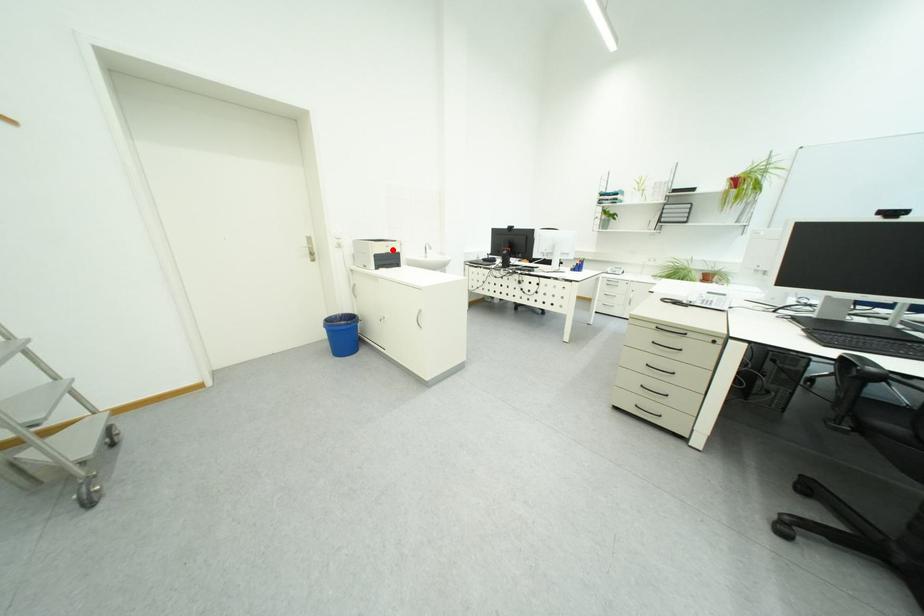
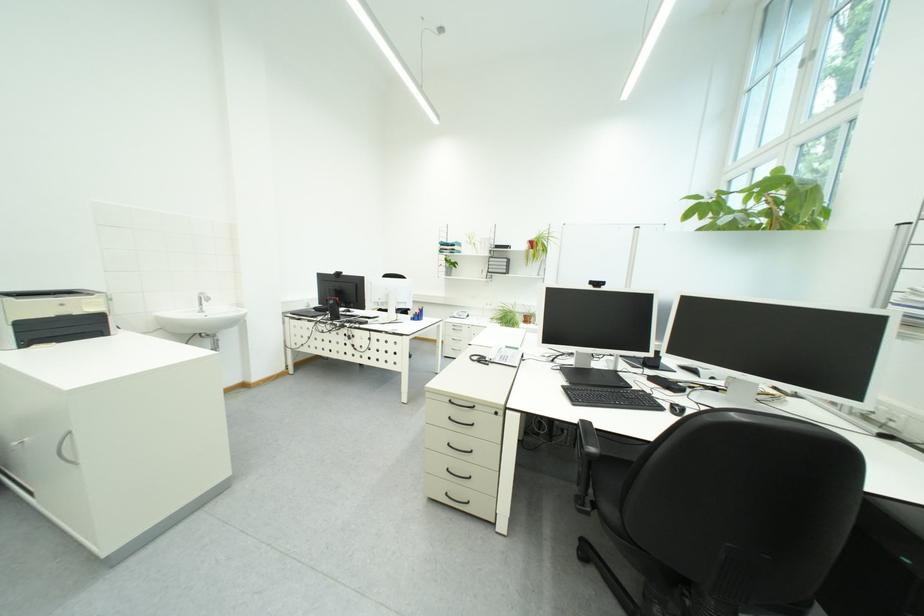
In the second image, find the point that corresponds to the highlighted location in the first image.

(55, 310)